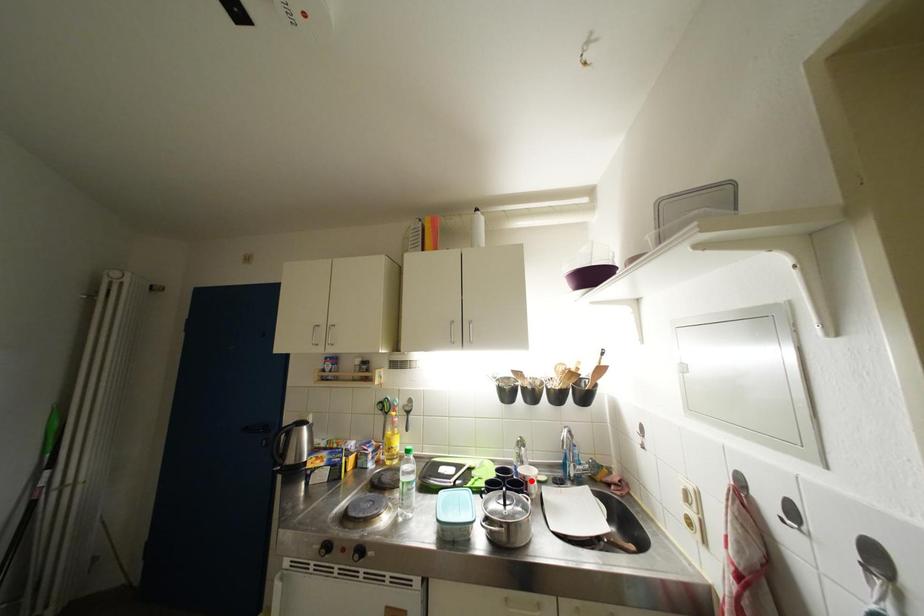
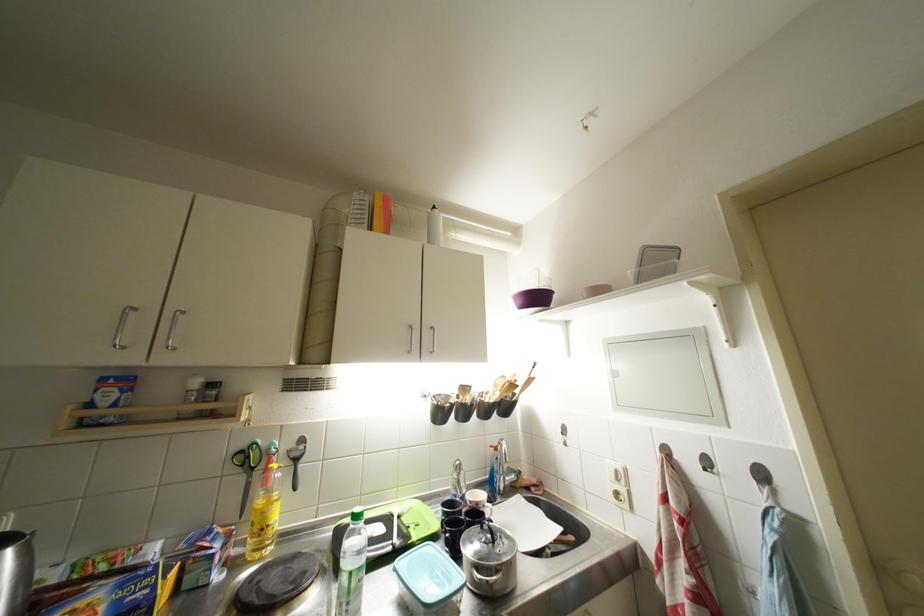
Where in the second image is the point corresponding to the highlighted location from the first image?

(483, 508)